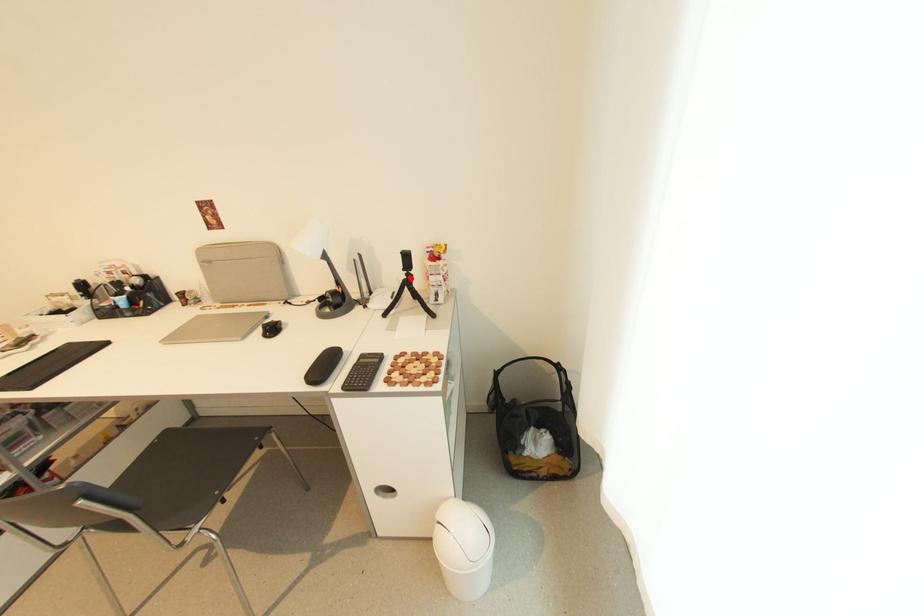
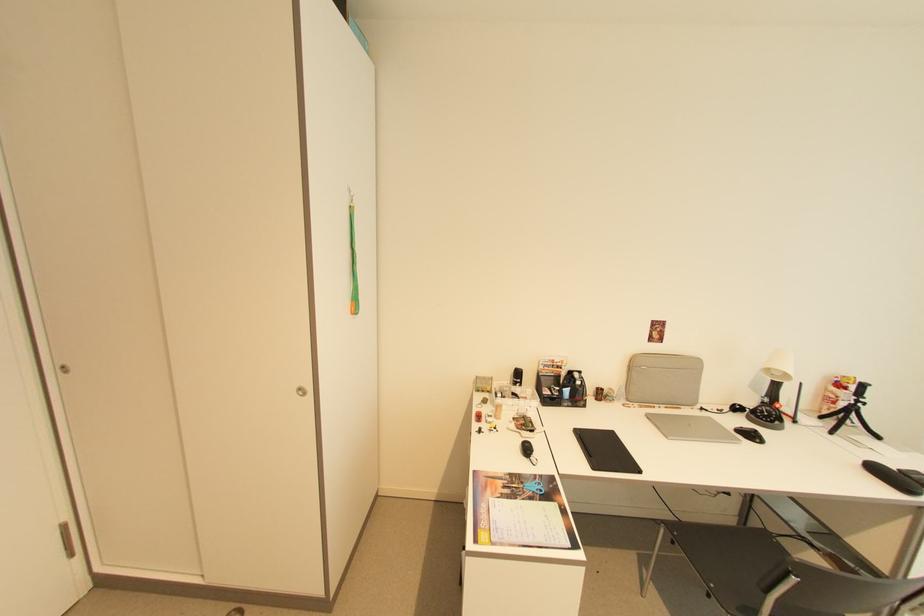
In the second image, find the point that corresponds to the highlighted location in the first image.

(857, 405)